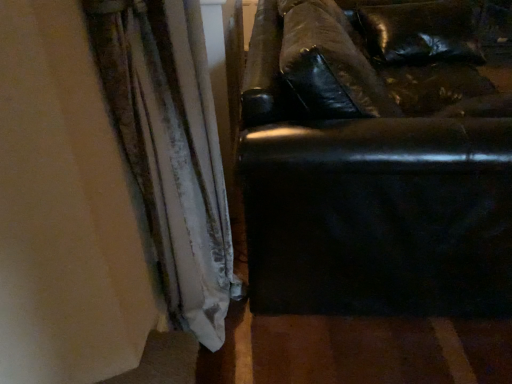
The image size is (512, 384). I want to click on black leather couch at right, so click(374, 164).

What do you see at coordinates (374, 164) in the screenshot? The image size is (512, 384). I see `black leather couch at right` at bounding box center [374, 164].

From the picture: Measure the distance between point (430,47) and camera.

They are 2.08 meters apart.

You are a GUI agent. You are given a task and a screenshot of the screen. Output one action in this format:
    pyautogui.click(x=<x>, y=<y>)
    Task: Click on the velvet-like white curtain at left
    This screenshot has height=384, width=512.
    Given the screenshot: What is the action you would take?
    pyautogui.click(x=170, y=149)

What do you see at coordinates (170, 149) in the screenshot?
I see `velvet-like white curtain at left` at bounding box center [170, 149].

Measure the distance between velvet-like white curtain at left and camera.

velvet-like white curtain at left is 29.99 inches away from camera.

What is the approximate width of velvet-like white curtain at left?

velvet-like white curtain at left is 10.14 inches wide.

Identify the location of black leather couch at right. The width and height of the screenshot is (512, 384). pyautogui.click(x=374, y=164).

Which is more to the left, velvet-like white curtain at left or black leather couch at right?

From the viewer's perspective, velvet-like white curtain at left appears more on the left side.

Is velvet-like white curtain at left positioned in front of black leather couch at right?

That is True.

Considering the positions of point (157, 184) and point (397, 107), is point (157, 184) closer or farther from the camera than point (397, 107)?

Clearly, point (157, 184) is closer to the camera than point (397, 107).

From the image's perspective, who appears lower, velvet-like white curtain at left or black leather couch at right?

velvet-like white curtain at left, from the image's perspective.

In the scene shown: From a real-world perspective, between velvet-like white curtain at left and black leather couch at right, who is vertically higher?

In real-world perspective, velvet-like white curtain at left is above.

Is velvet-like white curtain at left thinner than black leather couch at right?

Yes, velvet-like white curtain at left is thinner than black leather couch at right.

Considering the sizes of objects velvet-like white curtain at left and black leather couch at right in the image provided, who is shorter, velvet-like white curtain at left or black leather couch at right?

black leather couch at right is shorter.

Between velvet-like white curtain at left and black leather couch at right, which one has smaller size?

Result: With smaller size is velvet-like white curtain at left.

Is velvet-like white curtain at left situated inside black leather couch at right or outside?

velvet-like white curtain at left is outside black leather couch at right.

Are velvet-like white curtain at left and black leather couch at right far apart?

That's not correct — velvet-like white curtain at left is a little close to black leather couch at right.

Could you tell me if velvet-like white curtain at left is turned towards black leather couch at right?

Yes, velvet-like white curtain at left is facing black leather couch at right.

Locate an element on the screen. curtain on the left of black leather couch at right is located at coordinates (170, 149).

Based on their positions, is black leather couch at right located to the left or right of velvet-like white curtain at left?

Based on their positions, black leather couch at right is located to the right of velvet-like white curtain at left.

Is black leather couch at right closer to camera compared to velvet-like white curtain at left?

No, black leather couch at right is further to the viewer.

Is point (396, 115) closer or farther from the camera than point (166, 182)?

Point (396, 115).

Looking at this image, from the image's perspective, is black leather couch at right under velvet-like white curtain at left?

No, from the image's perspective, black leather couch at right is not below velvet-like white curtain at left.

From a real-world perspective, which is physically below, black leather couch at right or velvet-like white curtain at left?

In real-world perspective, black leather couch at right is lower.

Does black leather couch at right have a lesser width compared to velvet-like white curtain at left?

No, black leather couch at right is not thinner than velvet-like white curtain at left.

Considering the relative sizes of black leather couch at right and velvet-like white curtain at left in the image provided, is black leather couch at right taller than velvet-like white curtain at left?

No, black leather couch at right is not taller than velvet-like white curtain at left.

Is black leather couch at right smaller than velvet-like white curtain at left?

Incorrect, black leather couch at right is not smaller in size than velvet-like white curtain at left.

Would you say velvet-like white curtain at left is part of black leather couch at right's contents?

No, black leather couch at right does not contain velvet-like white curtain at left.

Would you say black leather couch at right is a long distance from velvet-like white curtain at left?

No.

Based on the photo, is black leather couch at right positioned with its back to velvet-like white curtain at left?

Yes, black leather couch at right is positioned with its back facing velvet-like white curtain at left.

This screenshot has width=512, height=384. What are the coordinates of `studio couch above the velvet-like white curtain at left (from the image's perspective)` in the screenshot? It's located at (374, 164).

Locate an element on the screen. studio couch on the right of velvet-like white curtain at left is located at coordinates (374, 164).

This screenshot has width=512, height=384. What are the coordinates of `studio couch above the velvet-like white curtain at left (from the image's perspective)` in the screenshot? It's located at (374, 164).